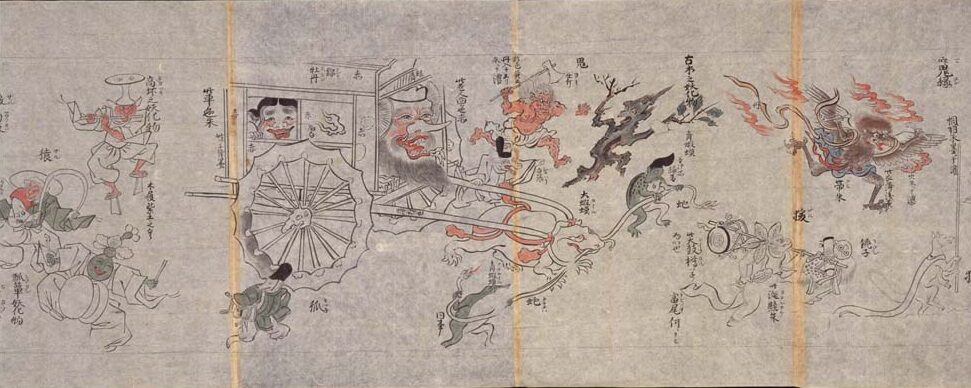
This screenshot has width=971, height=388. In order to click on art work in this screenshot , I will do coord(737,186).